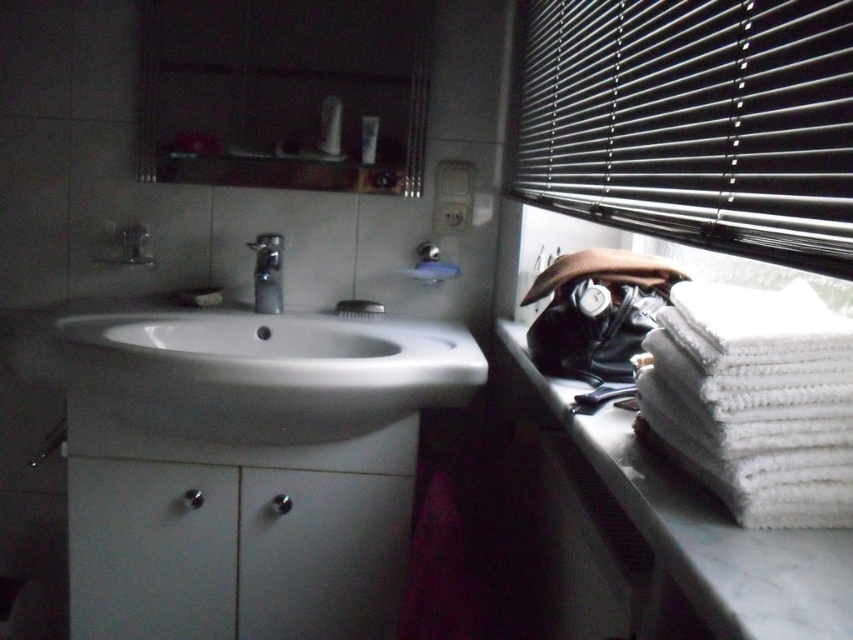
Question: Based on their relative distances, which object is farther from the black metal blinds at upper right?

Choices:
 (A) matte plastic toothbrush at upper center
 (B) white glossy sink at center
 (C) white plastic bottle at upper center
 (D) white marble towel at right

Answer: (C)

Question: Which point is farther from the camera taking this photo?

Choices:
 (A) (370, 116)
 (B) (755, 93)
 (C) (355, 432)
 (D) (846, 624)

Answer: (A)

Question: Is white marble towel at right bigger than satin nickel faucet at center?

Choices:
 (A) no
 (B) yes

Answer: (B)

Question: Does white glossy sink at center lie behind white plastic bottle at upper center?

Choices:
 (A) no
 (B) yes

Answer: (A)

Question: Which of the following is the closest to the observer?

Choices:
 (A) (358, 355)
 (B) (614, 83)
 (C) (334, 138)

Answer: (B)

Question: Can you confirm if black metal blinds at upper right is positioned below satin nickel faucet at center?

Choices:
 (A) no
 (B) yes

Answer: (A)